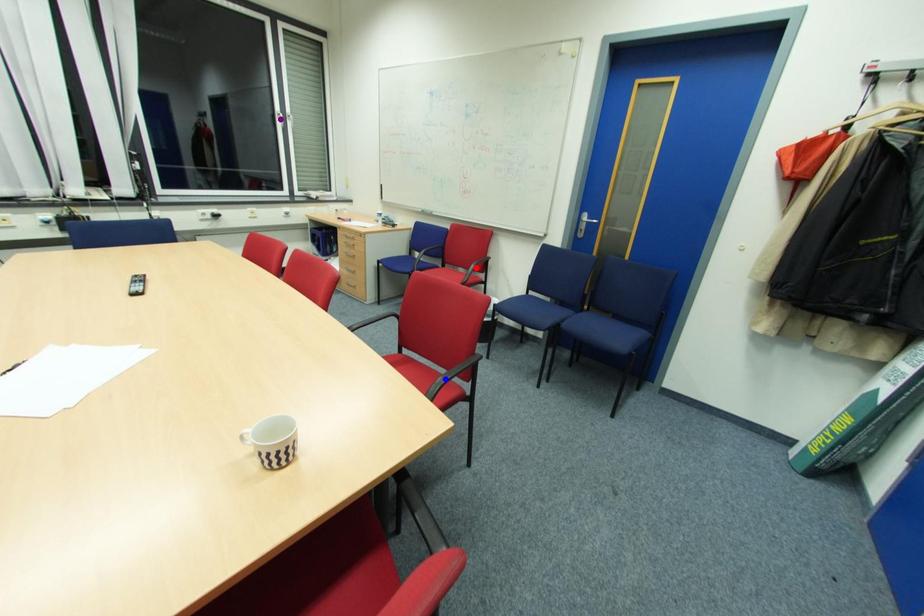
Order these from farthest to nearest:
red point, purple point, blue point

purple point < red point < blue point